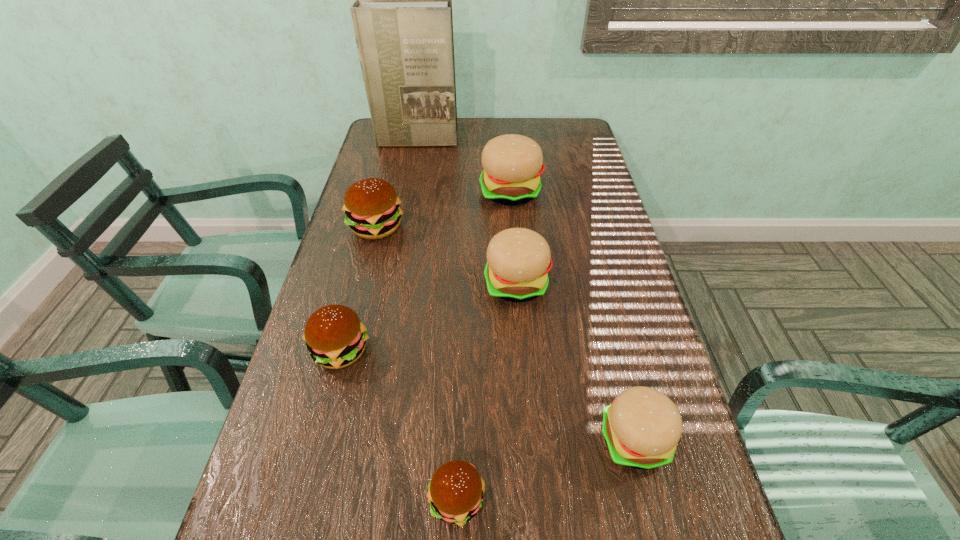
I want to click on the shortest hamburger, so pyautogui.click(x=455, y=492).

What are the coordinates of `the nearest brown hamburger` in the screenshot? It's located at (455, 492).

Where is `free space located 0.110m on the cover of the farthest object`? This screenshot has height=540, width=960. free space located 0.110m on the cover of the farthest object is located at coordinates (412, 165).

Find the location of a particular element. This screenshot has height=540, width=960. vacant space located 0.180m on the right of the biggest beige hamburger is located at coordinates (599, 192).

At what (x,y) coordinates should I click in order to perform the action: click on vacant space located 0.360m on the right of the biggest brown hamburger. Please return your answer as a coordinate pair (x, y). The height and width of the screenshot is (540, 960). Looking at the image, I should click on (529, 227).

Find the location of a particular element. The width and height of the screenshot is (960, 540). vacant space located on the front of the fourth farthest object is located at coordinates (519, 323).

Locate an element on the screen. free space located on the back of the second smallest brown hamburger is located at coordinates (357, 289).

You are a GUI agent. You are given a task and a screenshot of the screen. Output one action in this format:
    pyautogui.click(x=<x>, y=<y>)
    Task: Click on the free space located 0.170m on the back of the rightmost object
    Image resolution: width=960 pixels, height=540 pixels.
    Given the screenshot: What is the action you would take?
    click(x=610, y=339)

The width and height of the screenshot is (960, 540). I want to click on vacant area situated 0.310m on the back of the smallest brown hamburger, so click(463, 332).

This screenshot has height=540, width=960. I want to click on object positioned at the far edge, so click(x=402, y=16).